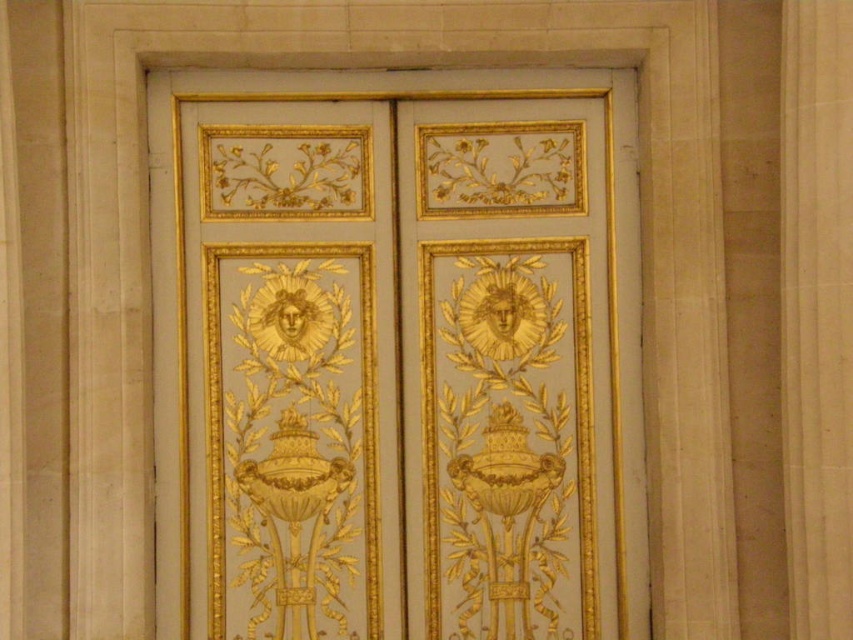
Question: Does gold painted wood door at center have a smaller size compared to white marble pillar at center?

Choices:
 (A) no
 (B) yes

Answer: (A)

Question: Among these points, which one is farthest from the camera?

Choices:
 (A) (798, 624)
 (B) (440, 358)

Answer: (B)

Question: Is gold painted wood door at center smaller than white marble pillar at center?

Choices:
 (A) yes
 (B) no

Answer: (B)

Question: Can you confirm if gold painted wood door at center is thinner than white marble pillar at center?

Choices:
 (A) yes
 (B) no

Answer: (B)

Question: Which object appears farthest from the camera in this image?

Choices:
 (A) gold painted wood door at center
 (B) white marble pillar at center

Answer: (A)